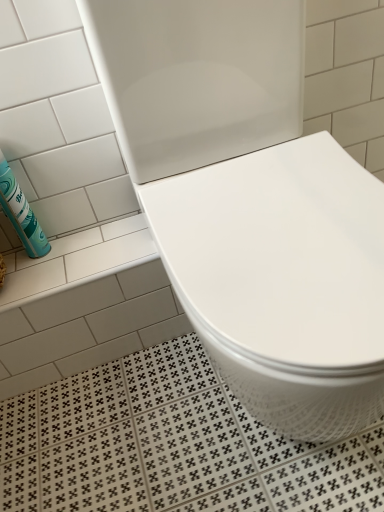
This screenshot has width=384, height=512. Find the location of `vacant area that is situated to the right of teal matte canister at left`. vacant area that is situated to the right of teal matte canister at left is located at coordinates (96, 246).